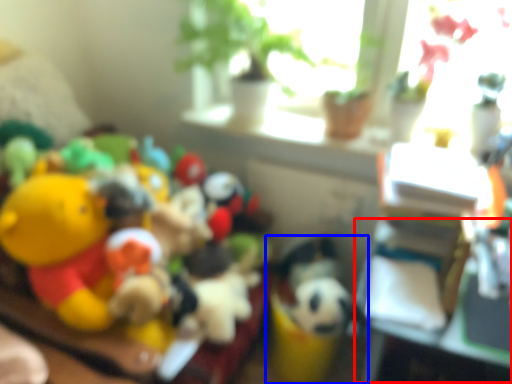
Question: Which object is closer to the camera taking this photo, table (highlighted by a red box) or toy (highlighted by a blue box)?

Choices:
 (A) table
 (B) toy

Answer: (A)